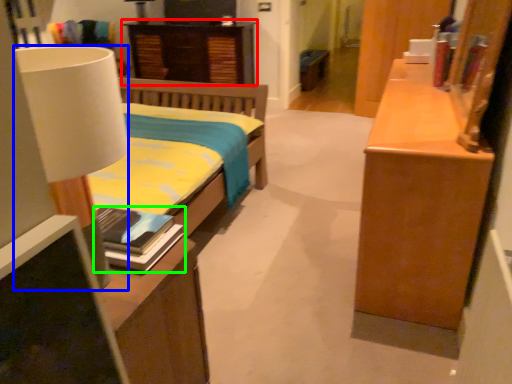
Question: Which is farther away from nightstand (highlighted by a red box)? lamp (highlighted by a blue box) or book (highlighted by a green box)?

Choices:
 (A) lamp
 (B) book

Answer: (A)